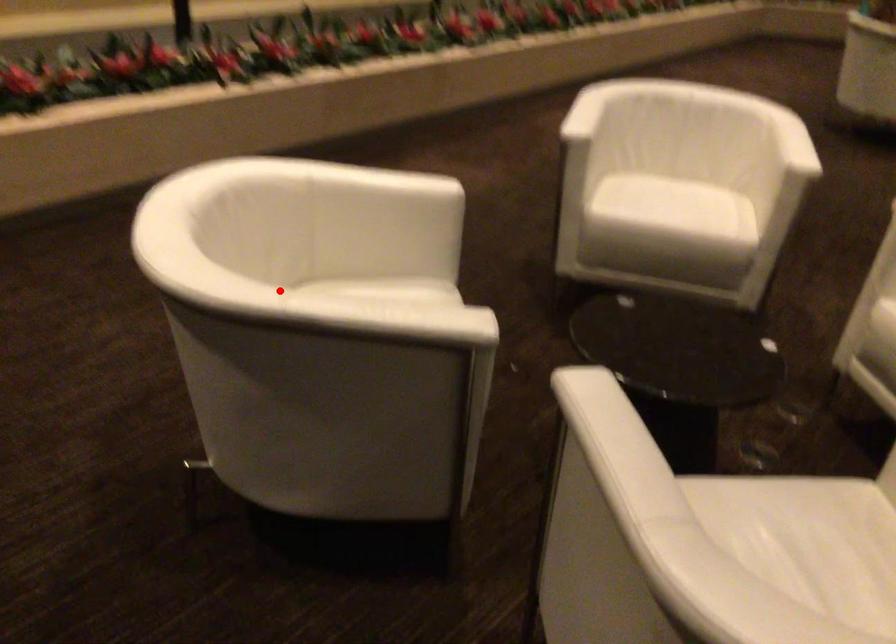
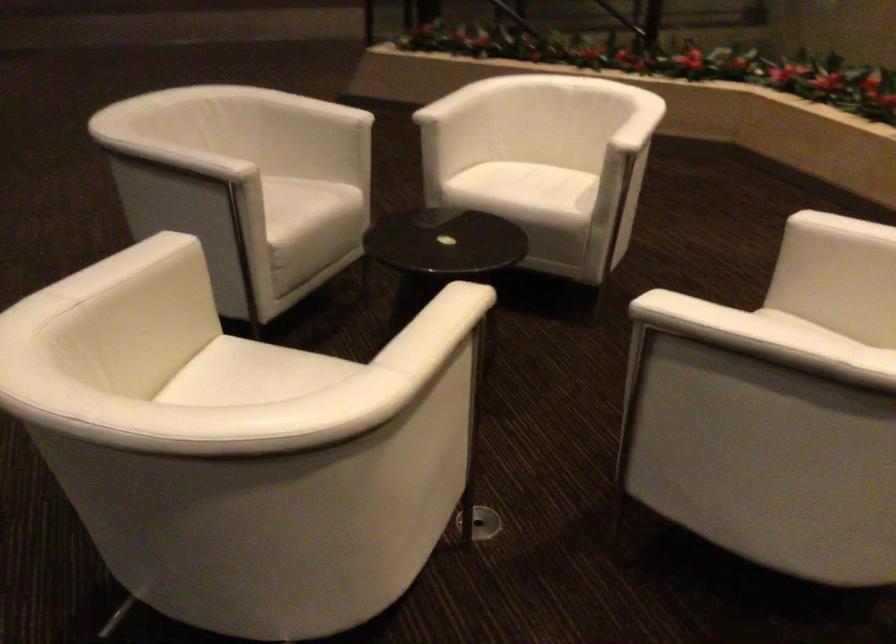
Question: I am providing you with two images of the same scene from different viewpoints. A red point is marked on the first image. At the location where the point appears in image 1, is it still visible in image 2?

Choices:
 (A) Yes
 (B) No

Answer: (A)